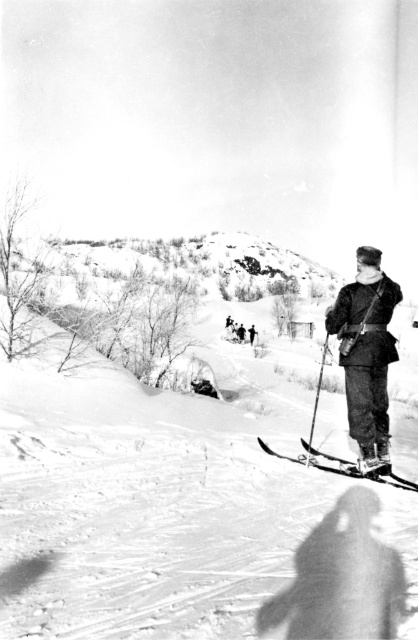
Question: Does white powder snow at center appear on the left side of dark woolen coat at right?

Choices:
 (A) no
 (B) yes

Answer: (B)

Question: Can you confirm if white powder snow at center is wider than metallic skis at center?

Choices:
 (A) no
 (B) yes

Answer: (B)

Question: Can you confirm if white powder snow at center is bigger than metallic skis at center?

Choices:
 (A) yes
 (B) no

Answer: (A)

Question: Which object is farther from the camera taking this photo?

Choices:
 (A) white powder snow at center
 (B) dark woolen coat at right
 (C) metallic skis at center

Answer: (C)

Question: Among these points, which one is farthest from the camera?

Choices:
 (A) (374, 259)
 (B) (107, 636)
 (C) (293, 460)

Answer: (C)

Question: Which of the following is the closest to the observer?

Choices:
 (A) metallic skis at center
 (B) white powder snow at center

Answer: (B)